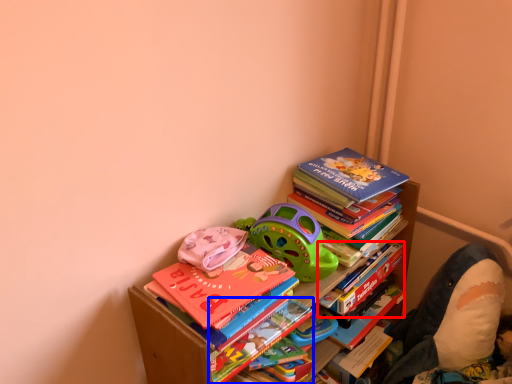
Question: Which of the following is the farthest to the observer, paperback book (highlighted by a red box) or paperback book (highlighted by a blue box)?

Choices:
 (A) paperback book
 (B) paperback book

Answer: (A)